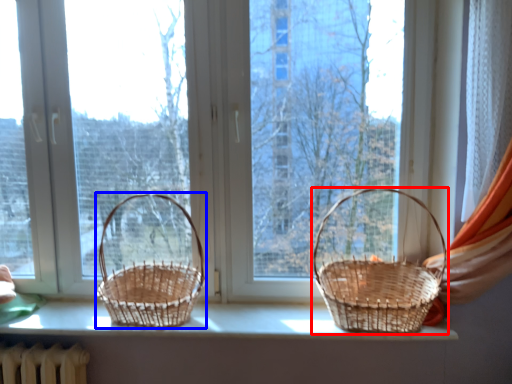
Question: Which of the following is the farthest to the observer, picnic basket (highlighted by a red box) or picnic basket (highlighted by a blue box)?

Choices:
 (A) picnic basket
 (B) picnic basket

Answer: (B)